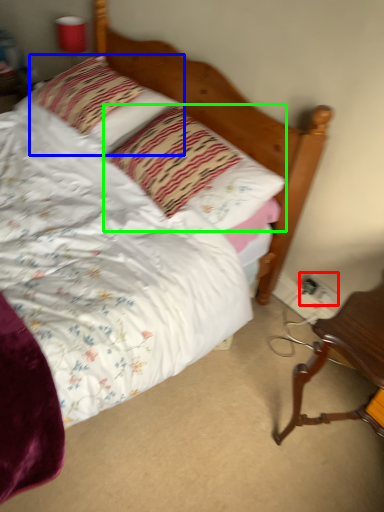
Question: Based on their relative distances, which object is farther from electric outlet (highlighted by a red box)? Choose from pillow (highlighted by a blue box) and pillow (highlighted by a green box).

Choices:
 (A) pillow
 (B) pillow

Answer: (A)